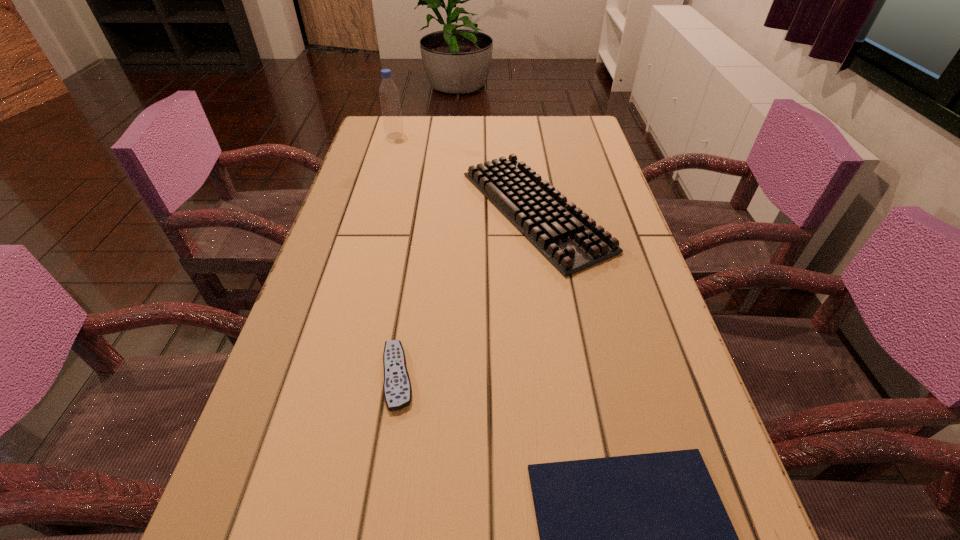
What are the coordinates of `bottle` in the screenshot? It's located at (393, 125).

Where is `the tallest object`? This screenshot has width=960, height=540. the tallest object is located at coordinates (393, 125).

Find the location of `computer keyboard`. computer keyboard is located at coordinates point(565,235).

The width and height of the screenshot is (960, 540). I want to click on the second tallest object, so click(565, 235).

You are a GUI agent. You are given a task and a screenshot of the screen. Output one action in this format:
    pyautogui.click(x=<x>, y=<y>)
    Task: Click on the remote control
    This screenshot has height=540, width=960.
    Given the screenshot: What is the action you would take?
    pyautogui.click(x=397, y=390)

Where is `the third tallest object`? This screenshot has height=540, width=960. the third tallest object is located at coordinates (397, 390).

Where is `blank space located 0.400m on the right of the farthest object`? blank space located 0.400m on the right of the farthest object is located at coordinates (529, 136).

The image size is (960, 540). What are the coordinates of `vacant region located 0.350m on the front of the third nearest object` in the screenshot? It's located at (567, 431).

Locate an element on the screen. This screenshot has height=540, width=960. vacant point located on the left of the remote control is located at coordinates (285, 376).

You are a GUI agent. You are given a task and a screenshot of the screen. Output one action in this format:
    pyautogui.click(x=<x>, y=<y>)
    Task: Click on the object located in the far edge section of the desktop
    
    Given the screenshot: What is the action you would take?
    pyautogui.click(x=393, y=125)